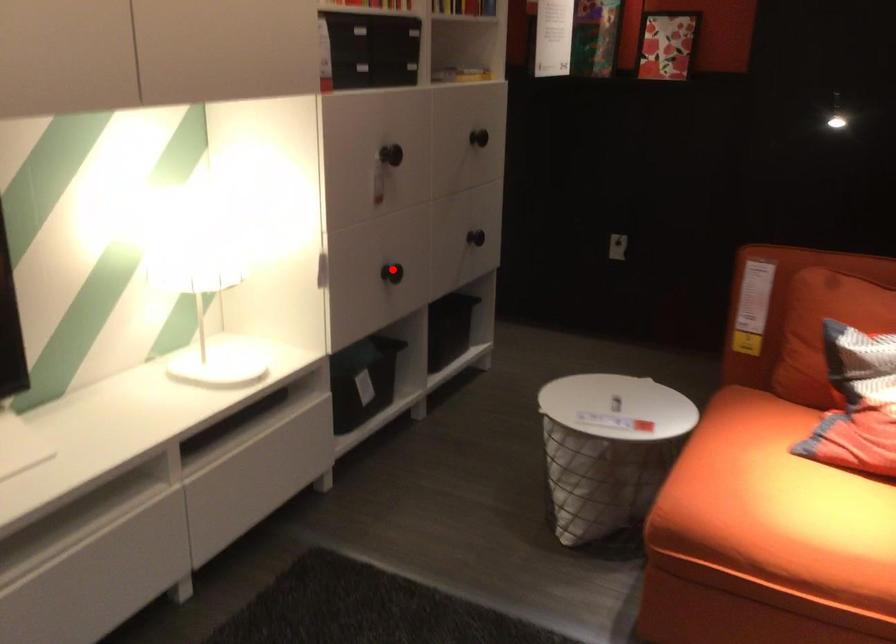
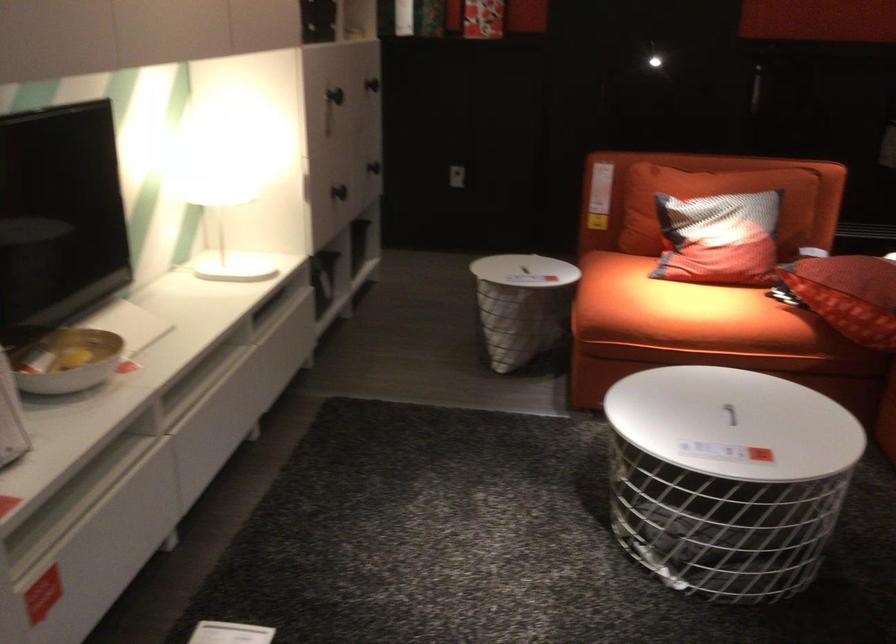
Question: I am providing you with two images of the same scene from different viewpoints. A red point is marked on the first image. At the location where the point appears in image 1, is it still visible in image 2?

Choices:
 (A) Yes
 (B) No

Answer: (A)